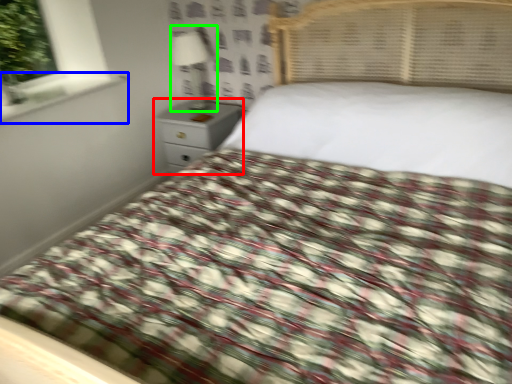
Question: Which object is positioned farthest from nightstand (highlighted by a red box)? Select from window sill (highlighted by a blue box) and lamp (highlighted by a green box).

Choices:
 (A) window sill
 (B) lamp

Answer: (A)